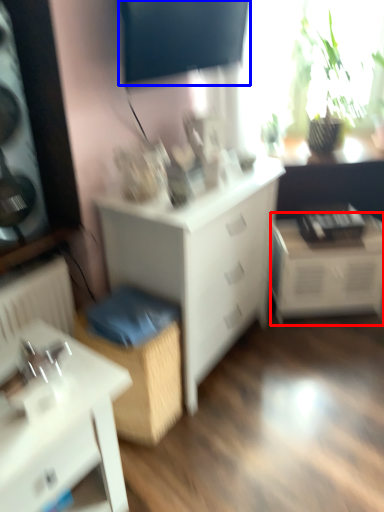
Question: Which object is further to the camera taking this photo, table (highlighted by a red box) or window screen (highlighted by a blue box)?

Choices:
 (A) table
 (B) window screen

Answer: (A)